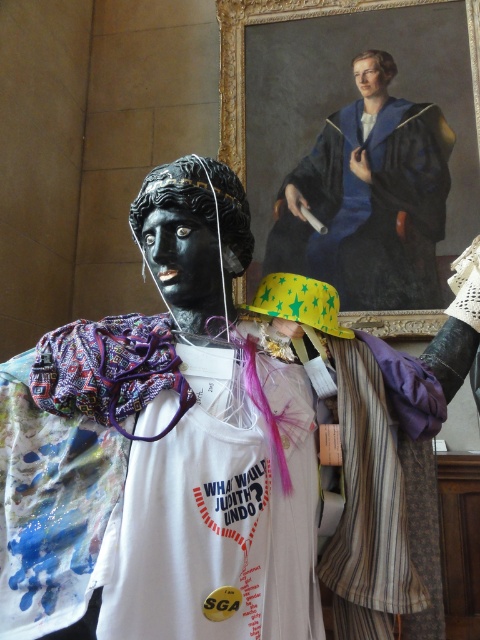
Between point (168, 317) and point (431, 236), which one is positioned in front?

Positioned in front is point (168, 317).

Looking at this image, measure the distance between painted fabric tank top at center and blue velvet robe at upper center.

painted fabric tank top at center and blue velvet robe at upper center are 3.00 meters apart.

Measure the distance between point (116,401) and camera.

They are 1.56 meters apart.

Locate an element on the screen. This screenshot has width=480, height=640. painted fabric tank top at center is located at coordinates (157, 486).